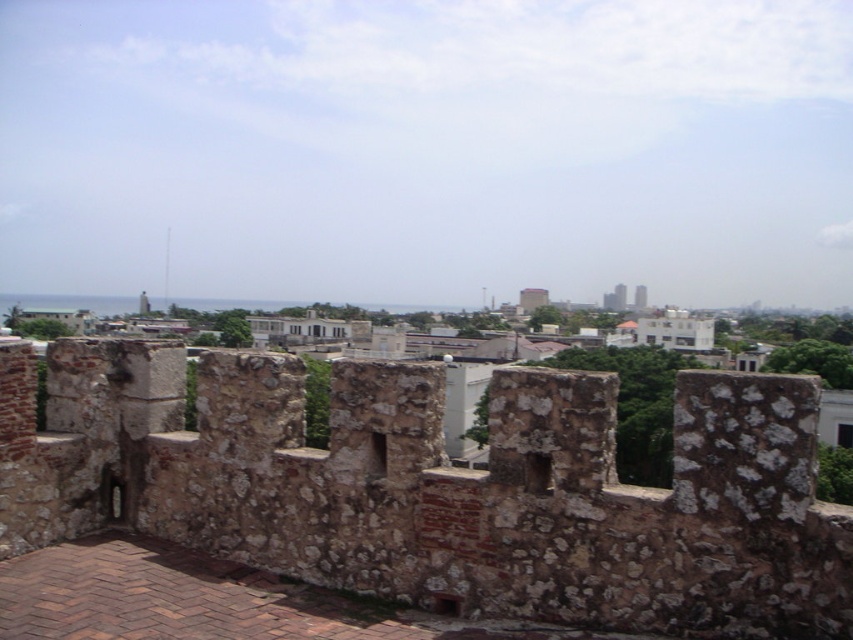
Does rustic stone wall at center appear on the left side of smooth concrete tower at center?

Yes, rustic stone wall at center is to the left of smooth concrete tower at center.

Where is `rustic stone wall at center`? This screenshot has height=640, width=853. rustic stone wall at center is located at coordinates (440, 486).

The height and width of the screenshot is (640, 853). What are the coordinates of `rustic stone wall at center` in the screenshot? It's located at (440, 486).

Image resolution: width=853 pixels, height=640 pixels. What do you see at coordinates (440, 486) in the screenshot?
I see `rustic stone wall at center` at bounding box center [440, 486].

Does rustic stone wall at center appear under white concrete tower at center?

Yes, rustic stone wall at center is below white concrete tower at center.

Who is more forward, (109, 468) or (636, 294)?

Point (109, 468) is more forward.

Where is `rustic stone wall at center`? Image resolution: width=853 pixels, height=640 pixels. rustic stone wall at center is located at coordinates (440, 486).

What do you see at coordinates (619, 296) in the screenshot?
I see `smooth concrete tower at center` at bounding box center [619, 296].

Is smooth concrete tower at center to the right of white concrete tower at center from the viewer's perspective?

In fact, smooth concrete tower at center is to the left of white concrete tower at center.

Describe the element at coordinates (619, 296) in the screenshot. This screenshot has height=640, width=853. I see `smooth concrete tower at center` at that location.

The width and height of the screenshot is (853, 640). I want to click on smooth concrete tower at center, so click(x=619, y=296).